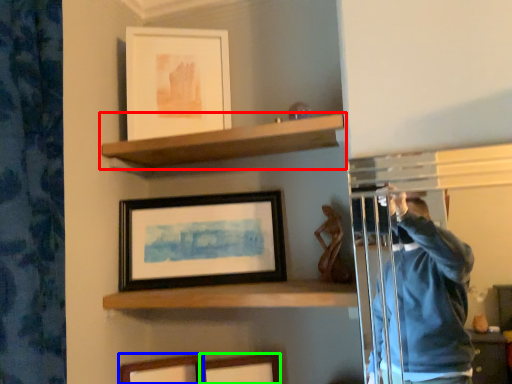
Question: Estimate the real-world distances between objects in this image. Which object is closer to shelf (highlighted by a red box), picture frame (highlighted by a blue box) or picture frame (highlighted by a green box)?

Choices:
 (A) picture frame
 (B) picture frame

Answer: (B)